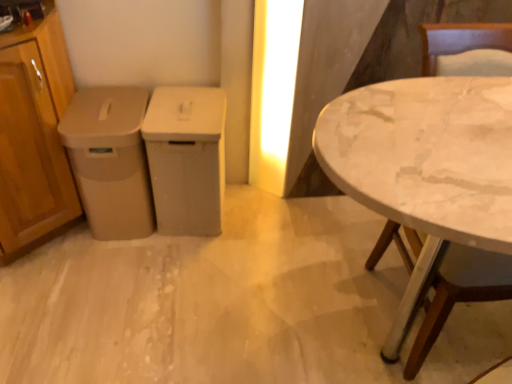
Question: From the image's perspective, is matte plastic trash can at center, the 3th cabinetry in the left-to-right sequence, positioned above or below wooden cabinet at left, which ranks as the first cabinetry in left-to-right order?

Choices:
 (A) above
 (B) below

Answer: (B)

Question: Is matte plastic trash can at center, which is counted as the 1th cabinetry, starting from the right, bigger or smaller than wooden cabinet at left, which ranks as the first cabinetry in left-to-right order?

Choices:
 (A) big
 (B) small

Answer: (B)

Question: Based on their relative distances, which object is nearer to the white marble table at right?

Choices:
 (A) beige plastic trash can at left, which is counted as the 2th cabinetry, starting from the right
 (B) wooden cabinet at left, which ranks as the first cabinetry in left-to-right order
 (C) matte plastic trash can at center, which is counted as the 1th cabinetry, starting from the right

Answer: (C)

Question: Considering the real-world distances, which object is farthest from the white marble table at right?

Choices:
 (A) beige plastic trash can at left, which is counted as the 2th cabinetry, starting from the right
 (B) wooden cabinet at left, which ranks as the first cabinetry in left-to-right order
 (C) matte plastic trash can at center, which is counted as the 1th cabinetry, starting from the right

Answer: (B)